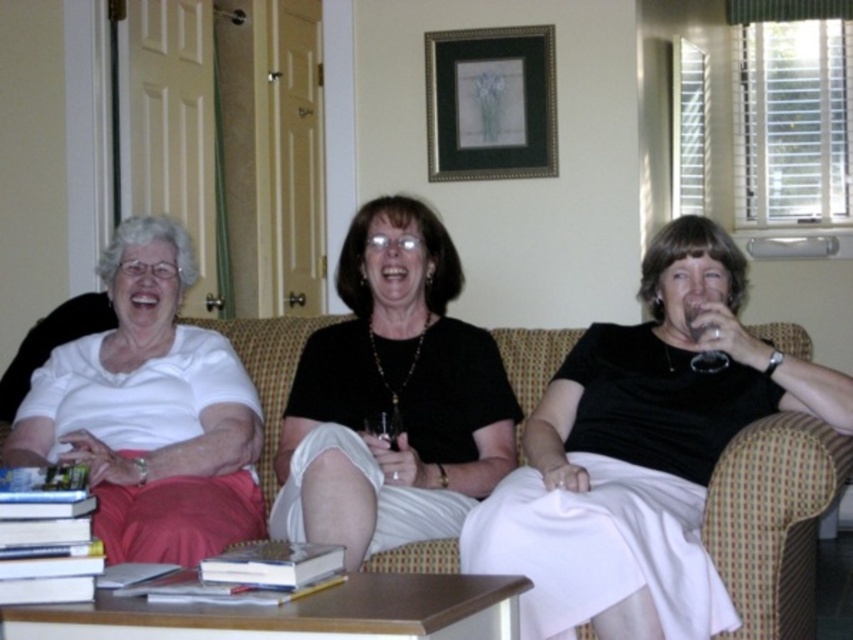
Question: Can you confirm if white matte shirt at left is positioned above plush beige couch at center?

Choices:
 (A) no
 (B) yes

Answer: (B)

Question: Does black matte dress at center appear on the left side of white matte shirt at left?

Choices:
 (A) no
 (B) yes

Answer: (A)

Question: Which of these objects is positioned farthest from the black matte dress at center?

Choices:
 (A) plush beige couch at center
 (B) white matte shirt at left
 (C) black wooden picture frame at upper center

Answer: (C)

Question: Which point is farther to the camera?

Choices:
 (A) click(260, 481)
 (B) click(434, 177)

Answer: (B)

Question: Which object is closer to the camera taking this photo?

Choices:
 (A) white matte shirt at left
 (B) plush beige couch at center
 (C) black matte dress at center

Answer: (C)

Question: Is white matte shirt at left to the left of black wooden picture frame at upper center from the viewer's perspective?

Choices:
 (A) no
 (B) yes

Answer: (B)